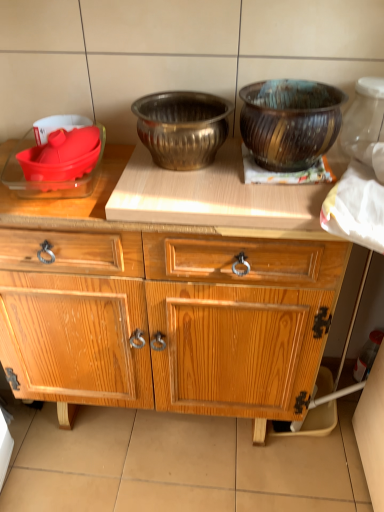
Question: Considering the relative sizes of brushed metal bowl at center, the second bowl from the right, and wooden cabinet at center in the image provided, is brushed metal bowl at center, the second bowl from the right, smaller than wooden cabinet at center?

Choices:
 (A) no
 (B) yes

Answer: (B)

Question: Is brushed metal bowl at center, the 3th bowl viewed from the left, further to the viewer compared to wooden cabinet at center?

Choices:
 (A) no
 (B) yes

Answer: (B)

Question: Is brushed metal bowl at center, the 3th bowl viewed from the left, taller than wooden cabinet at center?

Choices:
 (A) no
 (B) yes

Answer: (A)

Question: Can we say brushed metal bowl at center, the 3th bowl viewed from the left, lies outside wooden cabinet at center?

Choices:
 (A) yes
 (B) no

Answer: (A)

Question: Is brushed metal bowl at center, the 3th bowl viewed from the left, far away from wooden cabinet at center?

Choices:
 (A) yes
 (B) no

Answer: (B)

Question: From the image's perspective, is brushed metal bowl at center, the second bowl from the right, located beneath wooden cabinet at center?

Choices:
 (A) no
 (B) yes

Answer: (A)

Question: From a real-world perspective, is wooden cabinet at center on brushed metal bowl at center, the second bowl from the right?

Choices:
 (A) yes
 (B) no

Answer: (B)

Question: Can you confirm if wooden cabinet at center is smaller than brushed metal bowl at center, the second bowl from the right?

Choices:
 (A) yes
 (B) no

Answer: (B)

Question: Can you confirm if wooden cabinet at center is positioned to the right of brushed metal bowl at center, the second bowl from the right?

Choices:
 (A) no
 (B) yes

Answer: (A)

Question: Is wooden cabinet at center not close to brushed metal bowl at center, the 3th bowl viewed from the left?

Choices:
 (A) no
 (B) yes

Answer: (A)

Question: Are wooden cabinet at center and brushed metal bowl at center, the second bowl from the right, making contact?

Choices:
 (A) yes
 (B) no

Answer: (B)

Question: Would you say wooden cabinet at center is outside brushed metal bowl at center, the 3th bowl viewed from the left?

Choices:
 (A) no
 (B) yes

Answer: (B)

Question: Is wooden textured bowl at upper right, the fourth bowl in the left-to-right sequence, at the left side of translucent glass jar at upper right?

Choices:
 (A) no
 (B) yes

Answer: (B)